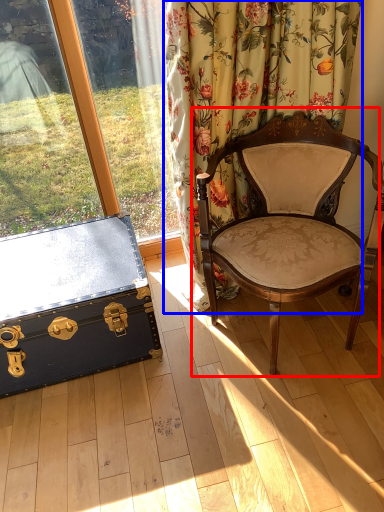
Question: Which point is closer to the camera, chair (highlighted by a red box) or curtain (highlighted by a blue box)?

Choices:
 (A) chair
 (B) curtain

Answer: (A)